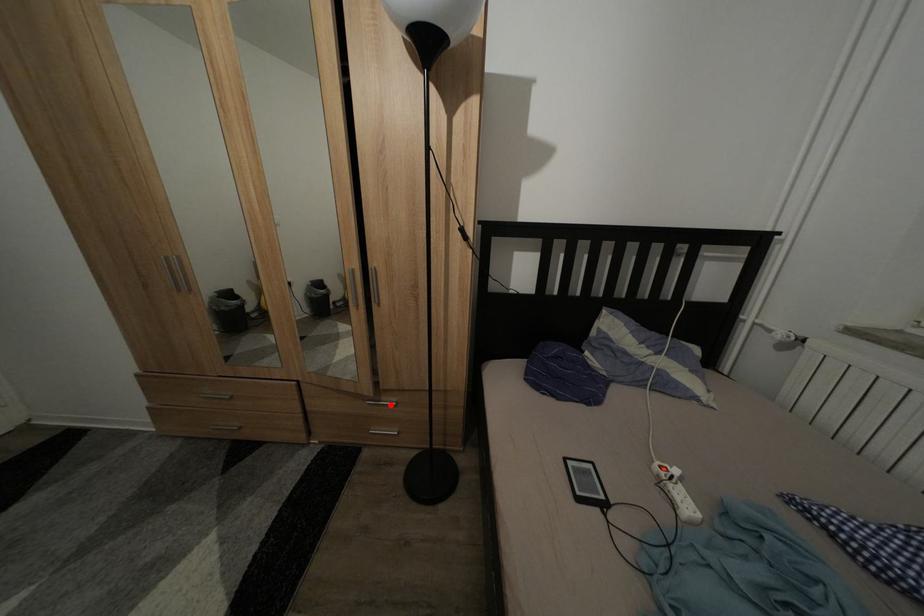
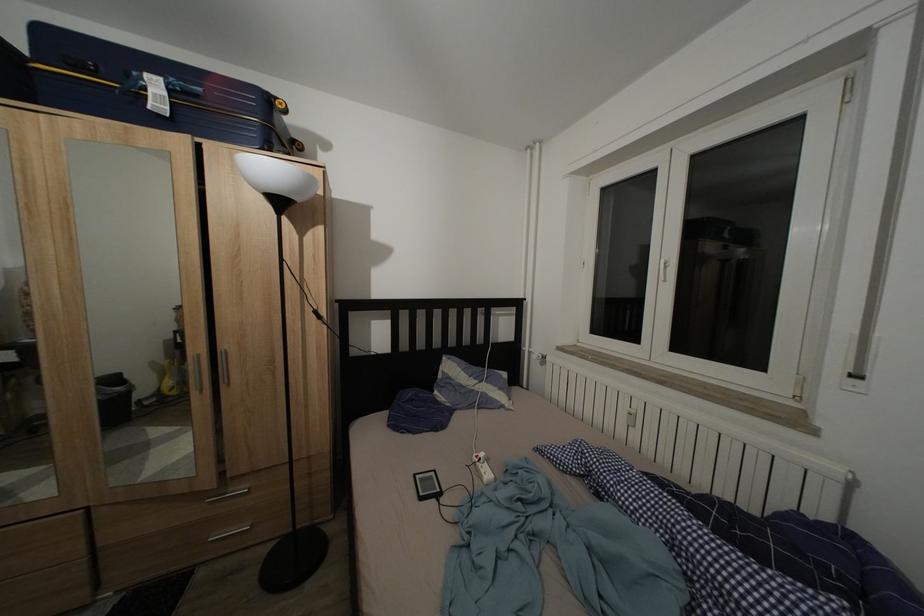
The point at the highlighted location is marked in the first image. Where is the corresponding point in the second image?

(237, 496)